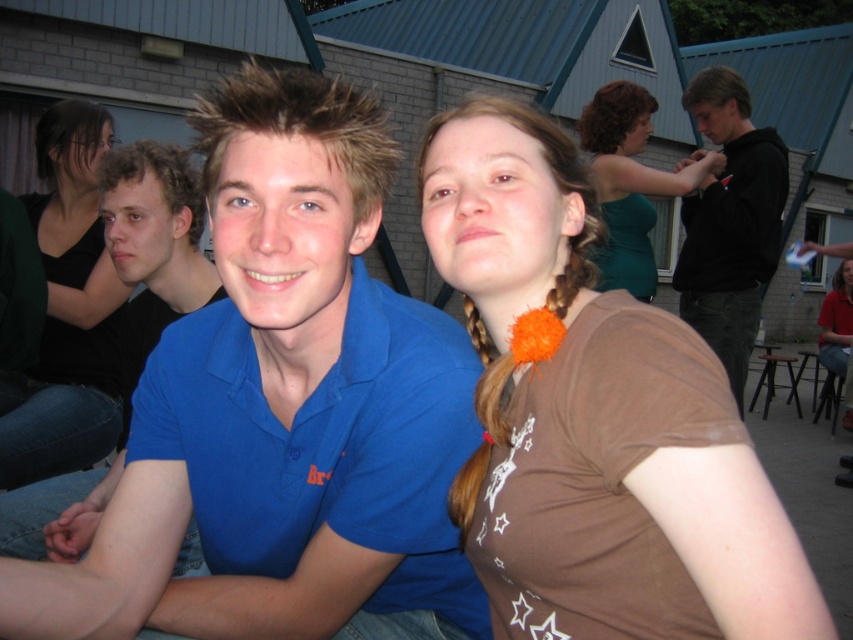
Does blue cotton shirt at center appear on the right side of brown fabric shirt at center?

No, blue cotton shirt at center is not to the right of brown fabric shirt at center.

Does blue cotton shirt at center appear over brown fabric shirt at center?

Incorrect, blue cotton shirt at center is not positioned above brown fabric shirt at center.

At what (x,y) coordinates should I click in order to perform the action: click on blue cotton shirt at center. Please return your answer as a coordinate pair (x, y). This screenshot has height=640, width=853. Looking at the image, I should click on (283, 413).

Measure the distance from blue cotton shirt at center to orange fuzzy ball at center.

10.12 inches

What do you see at coordinates (283, 413) in the screenshot? The image size is (853, 640). I see `blue cotton shirt at center` at bounding box center [283, 413].

Describe the element at coordinates (283, 413) in the screenshot. The height and width of the screenshot is (640, 853). I see `blue cotton shirt at center` at that location.

This screenshot has height=640, width=853. I want to click on blue cotton shirt at center, so click(x=283, y=413).

Does black hoodie at right appear under orange fuzzy ball at center?

Incorrect, black hoodie at right is not positioned below orange fuzzy ball at center.

Between black hoodie at right and orange fuzzy ball at center, which one appears on the right side from the viewer's perspective?

From the viewer's perspective, black hoodie at right appears more on the right side.

Between point (724, 150) and point (468, 477), which one is positioned behind?

The point (724, 150) is more distant.

You are a GUI agent. You are given a task and a screenshot of the screen. Output one action in this format:
    pyautogui.click(x=<x>, y=<y>)
    Task: Click on the black hoodie at right
    This screenshot has width=853, height=640.
    Given the screenshot: What is the action you would take?
    pyautogui.click(x=730, y=221)